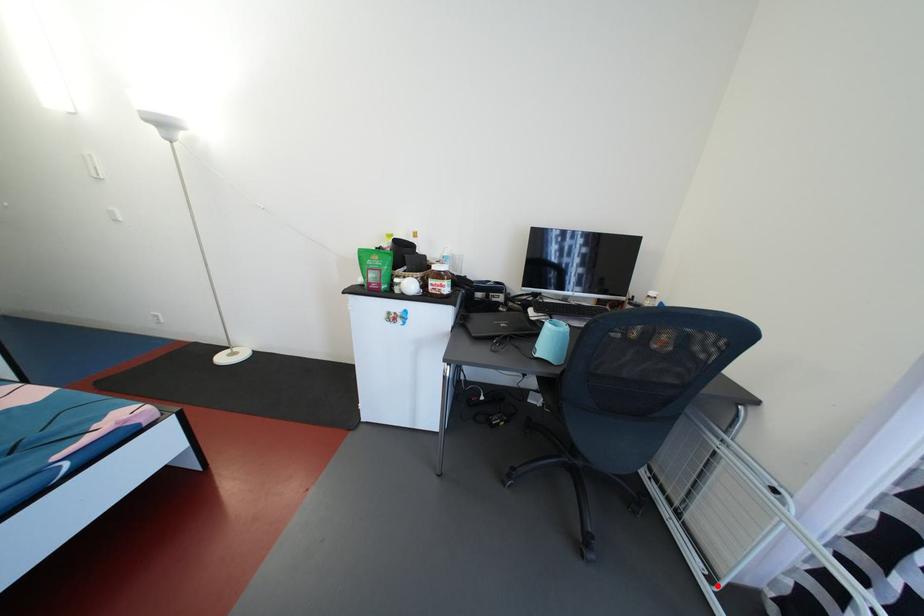
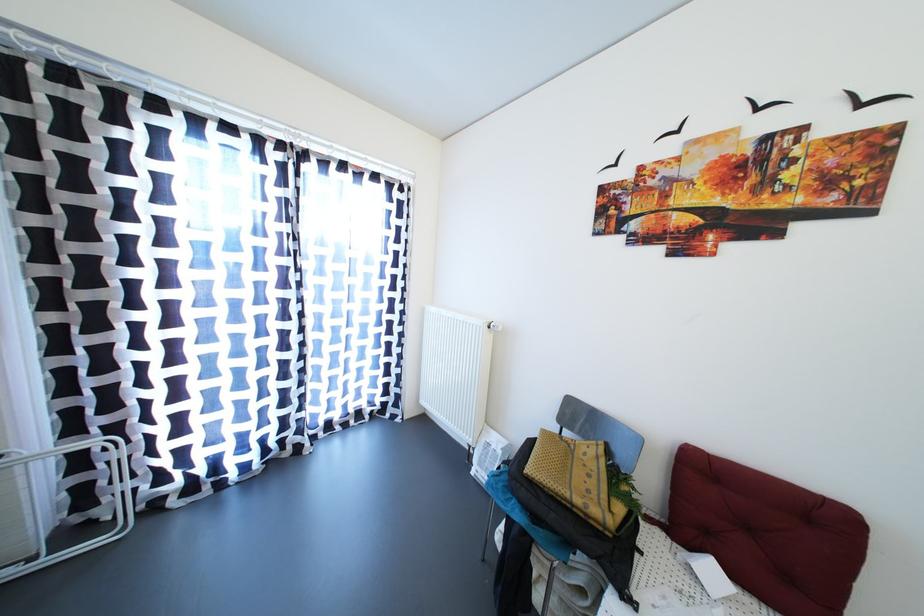
Where in the second image is the point corresponding to the highlighted location from the first image?

(39, 564)